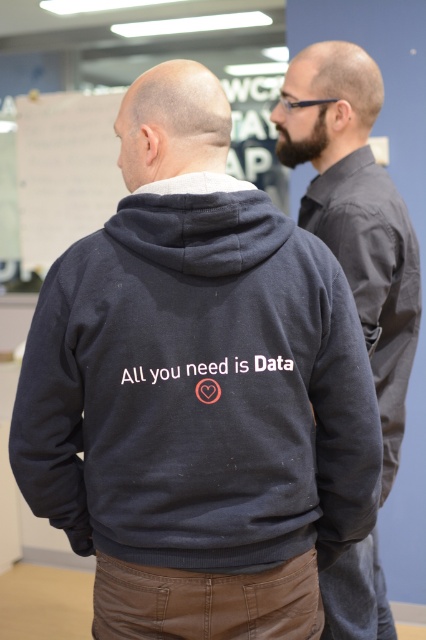
Question: Considering the relative positions of dark blue hoodie at center and dark gray hoodie at center in the image provided, where is dark blue hoodie at center located with respect to dark gray hoodie at center?

Choices:
 (A) right
 (B) left

Answer: (B)

Question: Which object appears farthest from the camera in this image?

Choices:
 (A) dark blue hoodie at center
 (B) dark gray hoodie at center

Answer: (B)

Question: Does dark blue hoodie at center lie in front of dark gray hoodie at center?

Choices:
 (A) no
 (B) yes

Answer: (B)

Question: Can you confirm if dark blue hoodie at center is wider than dark gray hoodie at center?

Choices:
 (A) no
 (B) yes

Answer: (B)